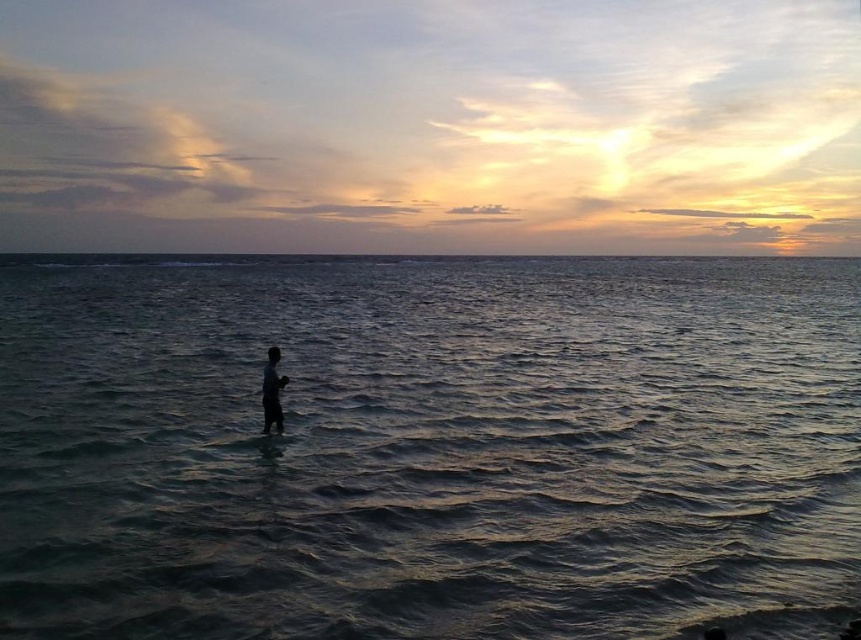
Who is higher up, dark blue water at center or dark skin human at center?

dark blue water at center

Does dark blue water at center have a smaller size compared to dark skin human at center?

Actually, dark blue water at center might be larger than dark skin human at center.

The width and height of the screenshot is (861, 640). Describe the element at coordinates (429, 448) in the screenshot. I see `dark blue water at center` at that location.

Identify the location of dark blue water at center. (429, 448).